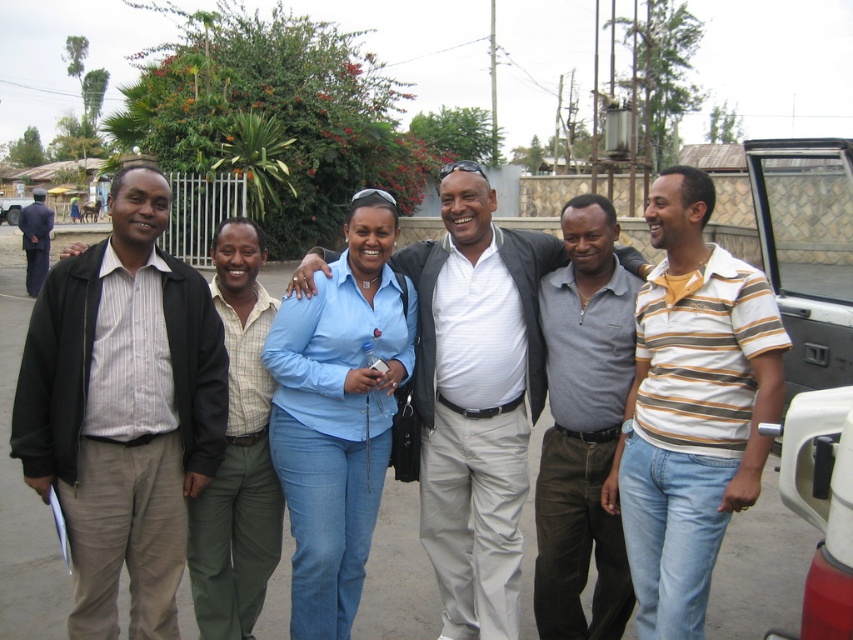
Is point (108, 602) positioned in front of point (42, 253)?

Yes, it is.

The image size is (853, 640). Find the location of `striped fabric shirt at left`. striped fabric shirt at left is located at coordinates (123, 410).

The width and height of the screenshot is (853, 640). What do you see at coordinates (693, 406) in the screenshot?
I see `white plastic pickup truck at right` at bounding box center [693, 406].

Is white plastic pickup truck at right below green cotton pants at center?

Actually, white plastic pickup truck at right is above green cotton pants at center.

Between point (709, 368) and point (229, 637), which one is positioned in front?

Point (709, 368) is more forward.

The width and height of the screenshot is (853, 640). I want to click on white plastic pickup truck at right, so click(693, 406).

Who is shorter, green cotton pants at center or dark blue uniform at left?

green cotton pants at center

The width and height of the screenshot is (853, 640). What do you see at coordinates (236, 452) in the screenshot?
I see `green cotton pants at center` at bounding box center [236, 452].

Find the location of `green cotton pants at center`. green cotton pants at center is located at coordinates (236, 452).

Identify the location of green cotton pants at center. (236, 452).